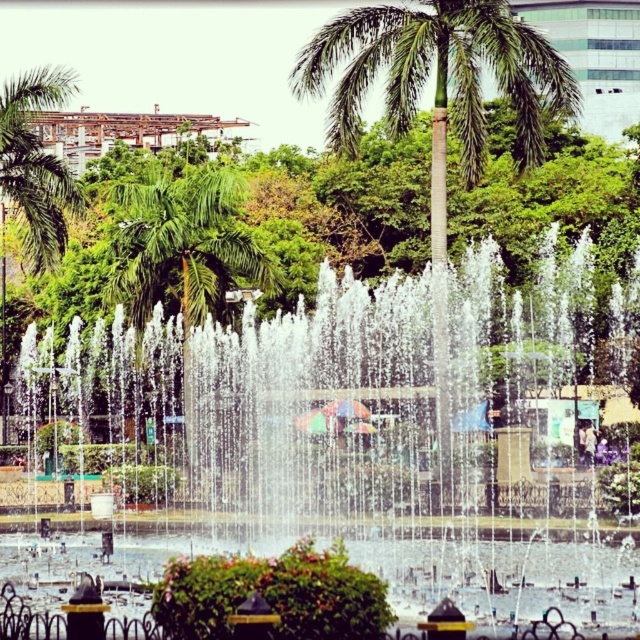
Does green leafy palm tree at center have a greater height compared to green leafy palm tree at upper left?

In fact, green leafy palm tree at center may be shorter than green leafy palm tree at upper left.

The height and width of the screenshot is (640, 640). What are the coordinates of `green leafy palm tree at center` in the screenshot? It's located at (436, 81).

Who is more distant from viewer, (406, 67) or (61, 218)?

Positioned behind is point (61, 218).

This screenshot has width=640, height=640. I want to click on green leafy palm tree at center, so click(436, 81).

Which is more to the left, clear water fountain at center or green leafy palm tree at center?

Positioned to the left is clear water fountain at center.

Between clear water fountain at center and green leafy palm tree at center, which one is positioned higher?

green leafy palm tree at center is above.

Between point (269, 371) and point (509, 61), which one is positioned in front?

Point (269, 371) is in front.

Image resolution: width=640 pixels, height=640 pixels. In order to click on clear water fountain at center in this screenshot , I will do `click(348, 444)`.

Who is higher up, clear water fountain at center or green leafy palm tree at upper left?

green leafy palm tree at upper left is higher up.

Does clear water fountain at center appear on the left side of green leafy palm tree at upper left?

Incorrect, clear water fountain at center is not on the left side of green leafy palm tree at upper left.

Does point (596, 413) come closer to viewer compared to point (17, 195)?

No, (596, 413) is behind (17, 195).

What are the coordinates of `clear water fountain at center` in the screenshot? It's located at (348, 444).